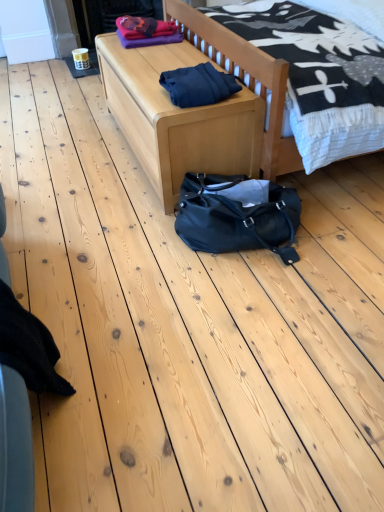
At what (x,y) coordinates should I click in order to perform the action: click on black fabric at lower left. Please return your answer as a coordinate pair (x, y). Looking at the image, I should click on (29, 347).

Is black fabric at lower left at the right side of light wood bench at center?

No, black fabric at lower left is not to the right of light wood bench at center.

Would you say black fabric at lower left is inside or outside light wood bench at center?

black fabric at lower left is spatially situated outside light wood bench at center.

From a real-world perspective, relative to light wood bench at center, is black fabric at lower left vertically above or below?

Clearly, from a real-world perspective, black fabric at lower left is below light wood bench at center.

What's the angular difference between black fabric at lower left and light wood bench at center's facing directions?

black fabric at lower left and light wood bench at center are facing 176 degrees away from each other.

Could you tell me if light wood bed at center is facing black fabric at lower left?

Yes.

The image size is (384, 512). I want to click on clothing on the left of light wood bed at center, so click(29, 347).

From the image's perspective, is light wood bed at center above or below black fabric at lower left?

Based on their image positions, light wood bed at center is located above black fabric at lower left.

From the picture: Between light wood bed at center and black fabric at lower left, which one is positioned in front?

black fabric at lower left is more forward.

Is black fabric at lower left positioned with its back to light wood bed at center?

No, black fabric at lower left is not facing away from light wood bed at center.

In the scene shown: Is black fabric at lower left positioned far away from light wood bed at center?

Yes, black fabric at lower left is far from light wood bed at center.

Between black fabric at lower left and light wood bed at center, which one has more height?

Standing taller between the two is light wood bed at center.

Which of these two, black fabric at lower left or light wood bed at center, is thinner?

black fabric at lower left is thinner.

Is dark blue fabric at center located within light wood bed at center?

No, dark blue fabric at center is not inside light wood bed at center.

Are light wood bed at center and dark blue fabric at center far apart?

No, light wood bed at center is in close proximity to dark blue fabric at center.

Is light wood bed at center oriented towards dark blue fabric at center?

Yes, light wood bed at center is turned towards dark blue fabric at center.

From the picture: Considering the sizes of objects light wood bed at center and dark blue fabric at center in the image provided, who is taller, light wood bed at center or dark blue fabric at center?

Standing taller between the two is light wood bed at center.

From a real-world perspective, is light wood bench at center located beneath black fabric at lower left?

Incorrect, from a real-world perspective, light wood bench at center is higher than black fabric at lower left.

Could you tell me if light wood bench at center is facing black fabric at lower left?

No, light wood bench at center is not aimed at black fabric at lower left.

How much distance is there between light wood bench at center and black fabric at lower left?

1.16 meters.

Can you confirm if light wood bench at center is taller than black fabric at lower left?

Indeed, light wood bench at center has a greater height compared to black fabric at lower left.

Can you confirm if dark blue fabric at center is smaller than black fabric at lower left?

Indeed, dark blue fabric at center has a smaller size compared to black fabric at lower left.

Is dark blue fabric at center not near black fabric at lower left?

Absolutely, dark blue fabric at center is distant from black fabric at lower left.

You are a GUI agent. You are given a task and a screenshot of the screen. Output one action in this format:
    pyautogui.click(x=<x>, y=<y>)
    Task: Click on the clothing in front of the dark blue fabric at center
    This screenshot has height=512, width=384.
    Given the screenshot: What is the action you would take?
    pyautogui.click(x=29, y=347)

Which object is positioned more to the left, dark blue fabric at center or black fabric at lower left?

From the viewer's perspective, black fabric at lower left appears more on the left side.

You are a GUI agent. You are given a task and a screenshot of the screen. Output one action in this format:
    pyautogui.click(x=<x>, y=<y>)
    Task: Click on the material in front of the light wood bench at center
    
    Given the screenshot: What is the action you would take?
    pyautogui.click(x=198, y=85)

Is the surface of dark blue fabric at center in direct contact with light wood bench at center?

No, dark blue fabric at center is not next to light wood bench at center.

Based on the photo, does dark blue fabric at center have a lesser width compared to light wood bench at center?

Yes, dark blue fabric at center is thinner than light wood bench at center.

Is light wood bench at center completely or partially inside dark blue fabric at center?

No, light wood bench at center is not a part of dark blue fabric at center.

Where is `clothing on the left of light wood bench at center`? The image size is (384, 512). clothing on the left of light wood bench at center is located at coordinates [29, 347].

Where is `bed on the right of the black fabric at lower left`? bed on the right of the black fabric at lower left is located at coordinates (243, 77).

From the image, which object appears to be farther from light wood bench at center, light wood bed at center or black fabric at lower left?

Among the two, black fabric at lower left is located further to light wood bench at center.

Consider the image. Considering their positions, is light wood bed at center positioned closer to light wood bench at center than dark blue fabric at center?

dark blue fabric at center is positioned closer to the anchor light wood bench at center.

Considering their positions, is dark blue fabric at center positioned closer to black fabric at lower left than light wood bench at center?

Based on the image, light wood bench at center appears to be nearer to black fabric at lower left.

Looking at this image, based on their spatial positions, is dark blue fabric at center or light wood bench at center closer to light wood bed at center?

The object closer to light wood bed at center is dark blue fabric at center.

Based on the photo, which object lies further to the anchor point black fabric at lower left, light wood bench at center or dark blue fabric at center?

Among the two, dark blue fabric at center is located further to black fabric at lower left.

Considering their positions, is light wood bench at center positioned closer to light wood bed at center than dark blue fabric at center?

dark blue fabric at center is closer to light wood bed at center.

Considering their positions, is dark blue fabric at center positioned further to light wood bench at center than light wood bed at center?

The object further to light wood bench at center is light wood bed at center.

When comparing their distances from light wood bed at center, does black fabric at lower left or light wood bench at center seem further?

black fabric at lower left lies further to light wood bed at center than the other object.

Locate an element on the screen. table that lies between light wood bed at center and black fabric at lower left from top to bottom is located at coordinates (x=177, y=118).

This screenshot has height=512, width=384. I want to click on material between light wood bench at center and black fabric at lower left in the vertical direction, so click(x=198, y=85).

The image size is (384, 512). In order to click on material situated between light wood bench at center and light wood bed at center from left to right in this screenshot , I will do `click(198, 85)`.

You are a GUI agent. You are given a task and a screenshot of the screen. Output one action in this format:
    pyautogui.click(x=<x>, y=<y>)
    Task: Click on the material between light wood bed at center and black fabric at lower left from top to bottom
    This screenshot has width=384, height=512.
    Given the screenshot: What is the action you would take?
    tap(198, 85)